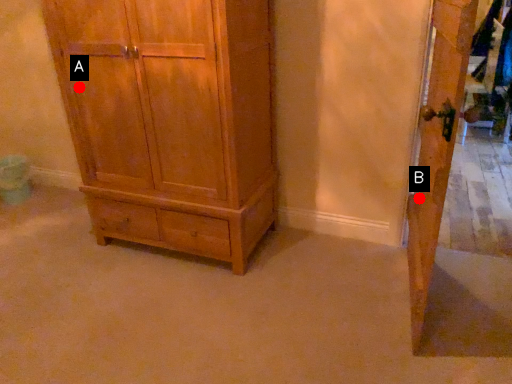
Question: Two points are circled on the image, labeled by A and B beside each circle. Which point is further to the camera?

Choices:
 (A) A is further
 (B) B is further

Answer: (A)